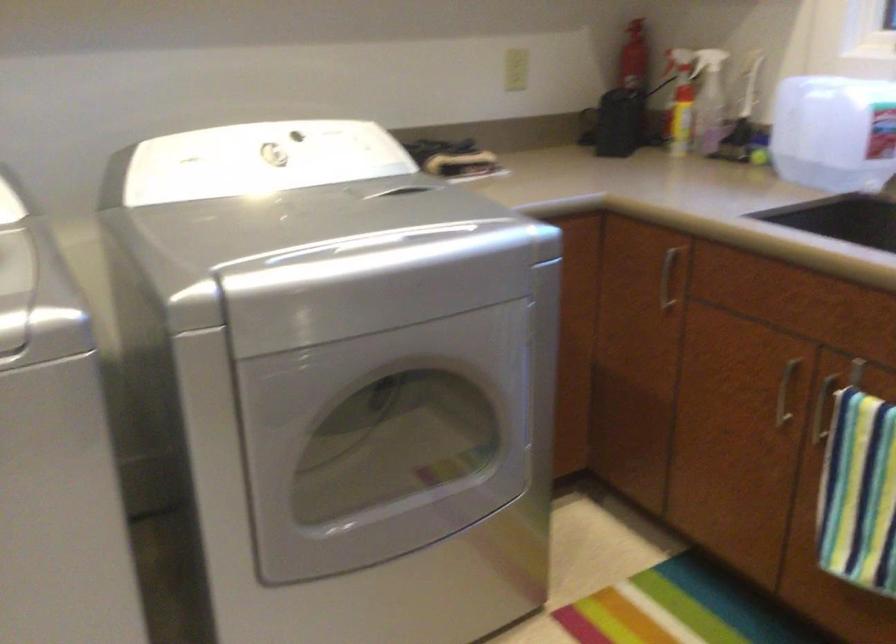
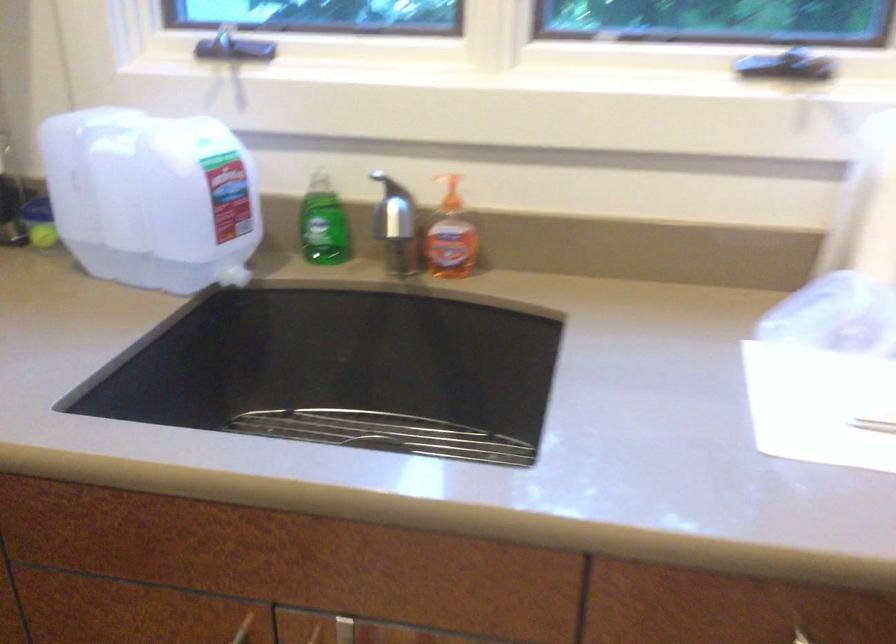
Question: The images are taken continuously from a first-person perspective. In which direction is your viewpoint rotating?

Choices:
 (A) Left
 (B) Right
 (C) Up
 (D) Down

Answer: (B)